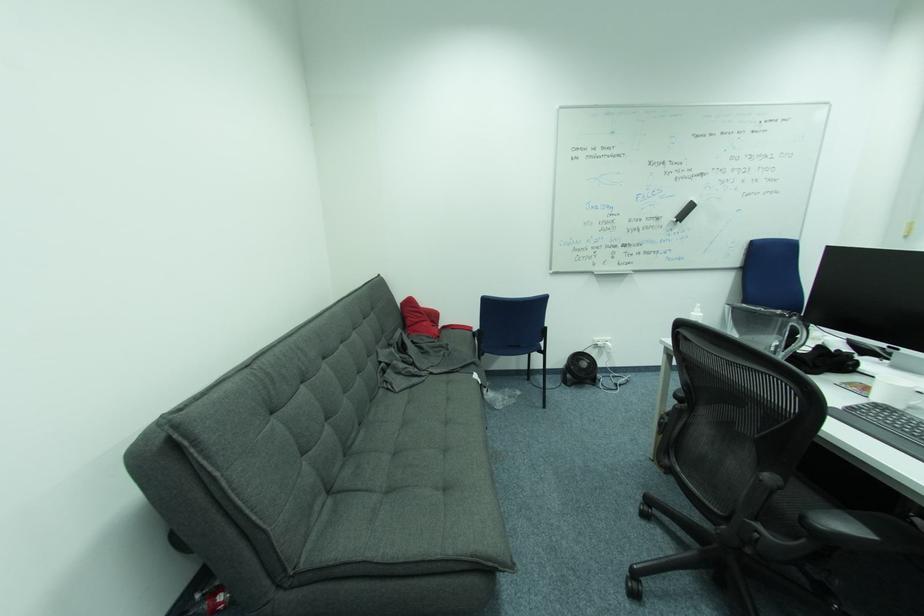
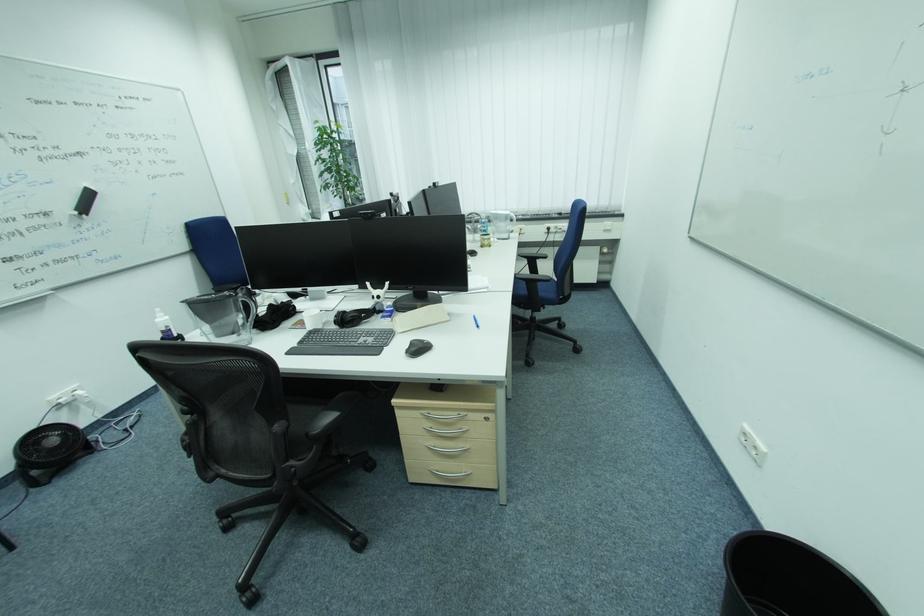
Locate, in the second image, the point that corresponds to the point at 797,318 in the first image.

(242, 294)